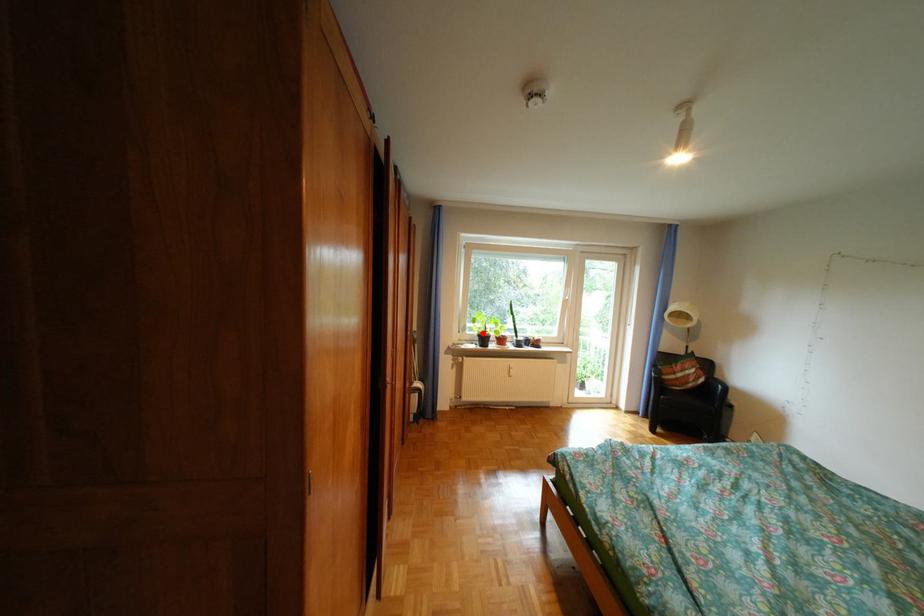
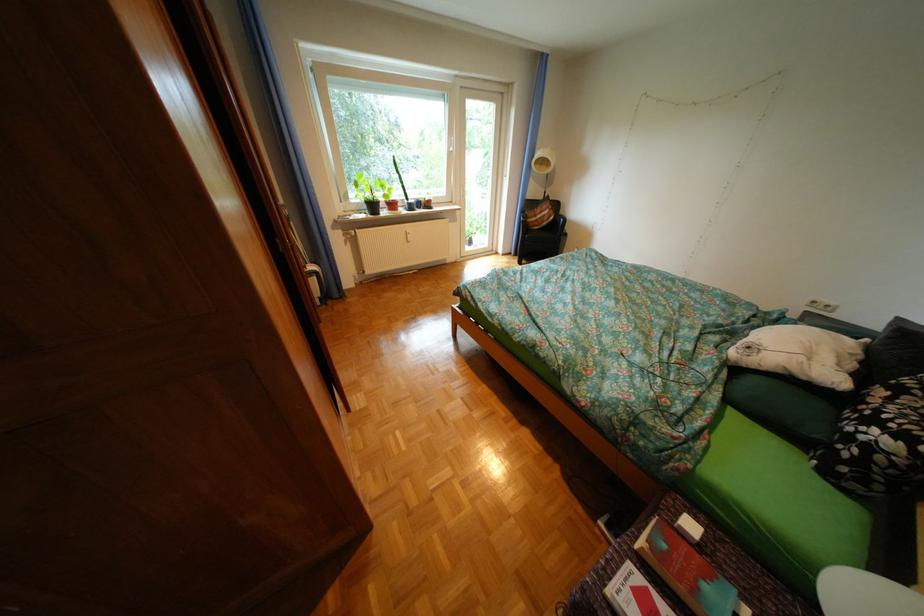
Where in the second image is the point corresponding to the highlighted location from the first image?

(368, 201)